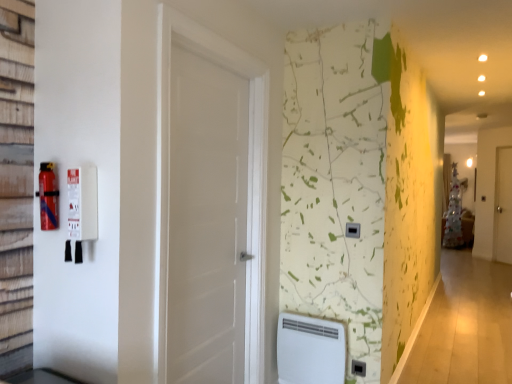
Question: Does black plastic electric outlet at center have a greater width compared to red matte fire extinguisher at left?

Choices:
 (A) no
 (B) yes

Answer: (A)

Question: From the image's perspective, is black plastic electric outlet at center below red matte fire extinguisher at left?

Choices:
 (A) no
 (B) yes

Answer: (B)

Question: Is black plastic electric outlet at center touching red matte fire extinguisher at left?

Choices:
 (A) yes
 (B) no

Answer: (B)

Question: Considering the relative positions of black plastic electric outlet at center and red matte fire extinguisher at left in the image provided, is black plastic electric outlet at center to the right of red matte fire extinguisher at left from the viewer's perspective?

Choices:
 (A) no
 (B) yes

Answer: (B)

Question: Is black plastic electric outlet at center positioned with its back to red matte fire extinguisher at left?

Choices:
 (A) no
 (B) yes

Answer: (A)

Question: Is black plastic electric outlet at center not close to red matte fire extinguisher at left?

Choices:
 (A) yes
 (B) no

Answer: (A)

Question: Considering the relative positions of black plastic/light switch at center-right and black plastic electric outlet at center in the image provided, is black plastic/light switch at center-right behind black plastic electric outlet at center?

Choices:
 (A) no
 (B) yes

Answer: (A)

Question: Considering the relative sizes of black plastic/light switch at center-right and black plastic electric outlet at center in the image provided, is black plastic/light switch at center-right thinner than black plastic electric outlet at center?

Choices:
 (A) no
 (B) yes

Answer: (A)

Question: Is there a large distance between black plastic/light switch at center-right and black plastic electric outlet at center?

Choices:
 (A) no
 (B) yes

Answer: (A)

Question: Is black plastic/light switch at center-right facing away from black plastic electric outlet at center?

Choices:
 (A) no
 (B) yes

Answer: (A)

Question: Could you tell me if black plastic/light switch at center-right is facing black plastic electric outlet at center?

Choices:
 (A) no
 (B) yes

Answer: (A)

Question: Is black plastic electric outlet at center surrounded by black plastic/light switch at center-right?

Choices:
 (A) no
 (B) yes

Answer: (A)

Question: From a real-world perspective, is black plastic electric outlet at center over white matte door at center, acting as the 1th door starting from the left?

Choices:
 (A) yes
 (B) no

Answer: (B)